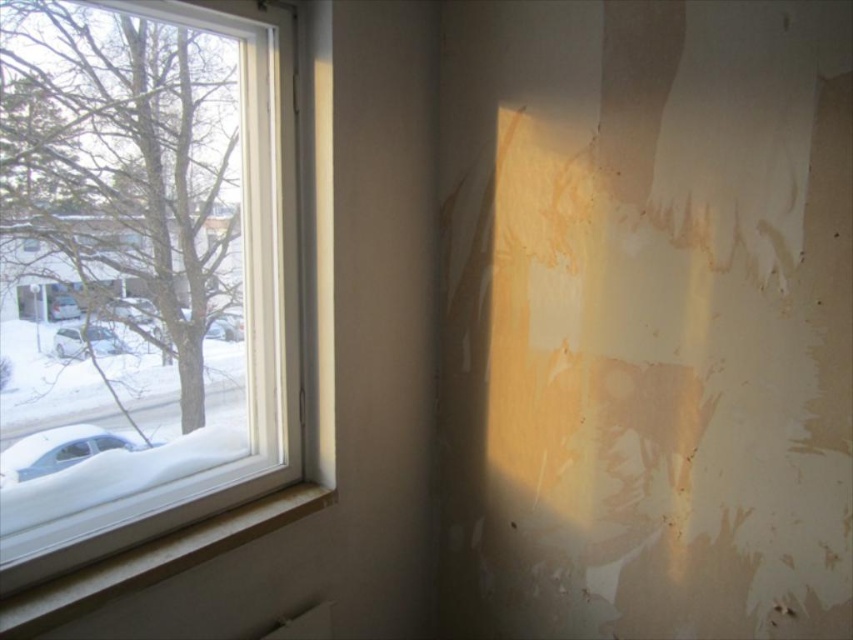
Question: Is white wood at lower left closer to camera compared to white matte car at left?

Choices:
 (A) yes
 (B) no

Answer: (A)

Question: Which of the following is the farthest from the observer?

Choices:
 (A) white glossy car at left
 (B) white wood at lower left

Answer: (A)

Question: Which of the following is the closest to the observer?

Choices:
 (A) white glossy car at left
 (B) white matte car at left
 (C) white plastic window at left
 (D) white wood at lower left

Answer: (D)

Question: Does white plastic window at left appear over white wood at lower left?

Choices:
 (A) no
 (B) yes

Answer: (B)

Question: Based on their relative distances, which object is farther from the white wood at lower left?

Choices:
 (A) white plastic window at left
 (B) white glossy car at left
 (C) white matte car at left

Answer: (B)

Question: Does white matte car at left appear on the left side of white glossy car at left?

Choices:
 (A) no
 (B) yes

Answer: (B)